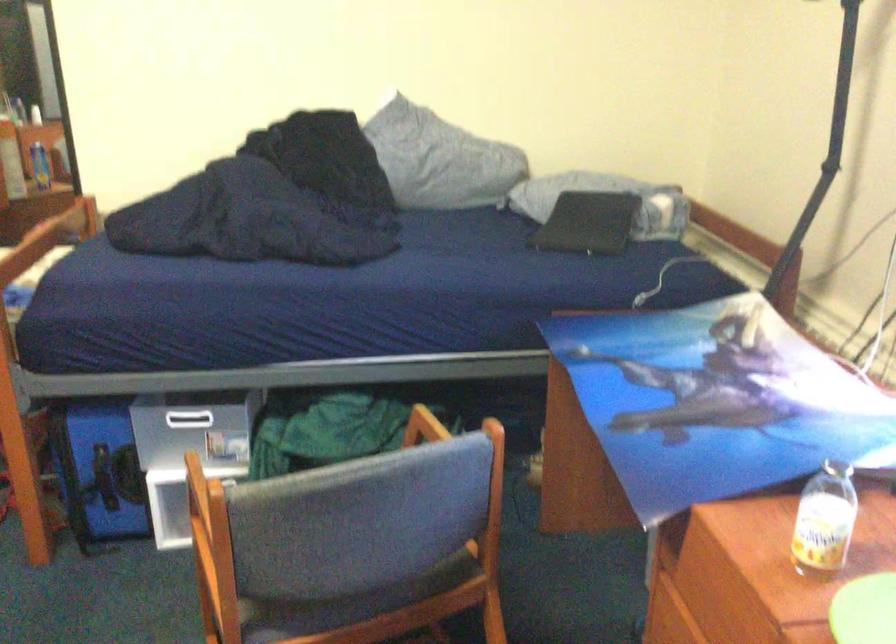
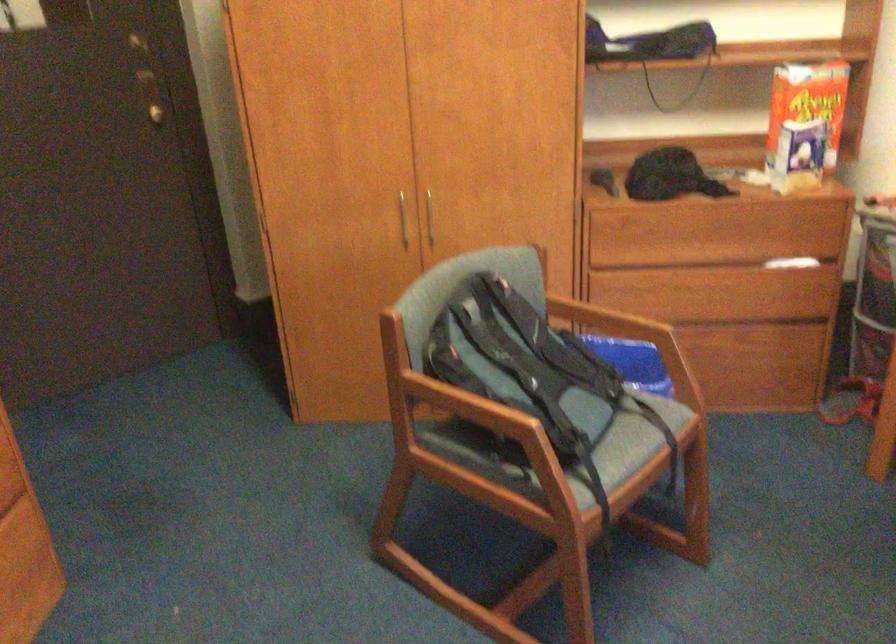
Question: The camera is either moving clockwise (left) or counter-clockwise (right) around the object. The first image is from the beginning of the video and the second image is from the end. Is the camera moving left or right when shooting the video?

Choices:
 (A) Left
 (B) Right

Answer: (B)